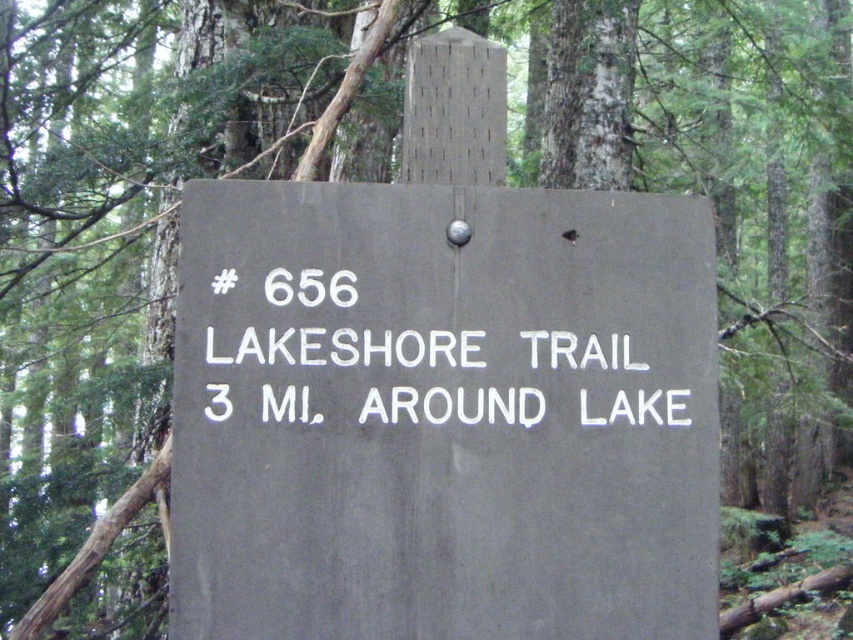
You are a hiker trying to read the signpost in the forest. The gray matte sign at center and the white painted text at center are both visible. Which object is located lower in the image?

The gray matte sign at center is positioned under the white painted text at center, so the gray matte sign at center is lower in the image.

You are a hiker with a 2.5 meter long backpack. You want to place your backpack between the gray matte sign at center and the metal fastener near the top center of the sign. Will the backpack fit in the space between them?

The distance between the gray matte sign at center and the metal fastener near the top center of the sign is 2.47 meters. Since the backpack is 2.5 meters long, it will not fit in the space between them as the space is slightly shorter than the backpack.

Looking at this image, you are a hiker who wants to read the white painted text at center on the gray matte sign at center. Can you see the text clearly from a distance of 10 meters away?

The gray matte sign at center is bigger than the white painted text at center, so the text should be legible from 10 meters away as the sign provides a clear contrast and sufficient size for readability.